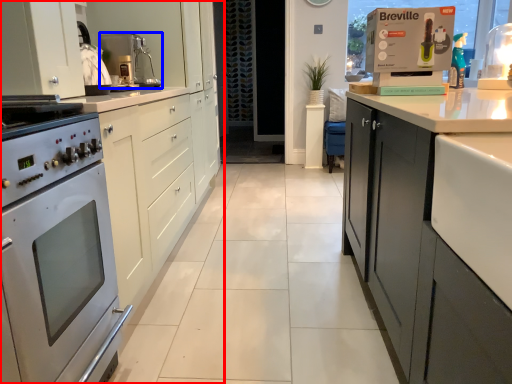
Question: Which object appears farthest to the camera in this image, cabinetry (highlighted by a red box) or kitchen appliance (highlighted by a blue box)?

Choices:
 (A) cabinetry
 (B) kitchen appliance

Answer: (B)